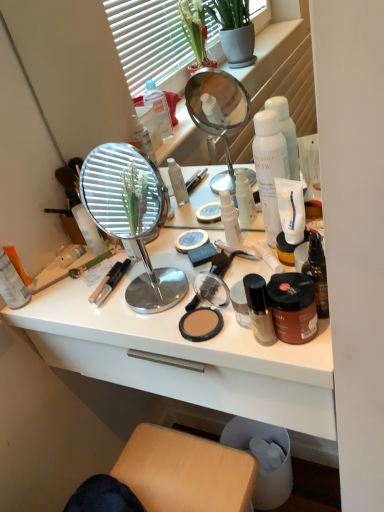
The image size is (384, 512). In order to click on free space to the left of brown matte jar at center-right, which appears as the second toiletry when viewed from the right in this screenshot , I will do `click(202, 334)`.